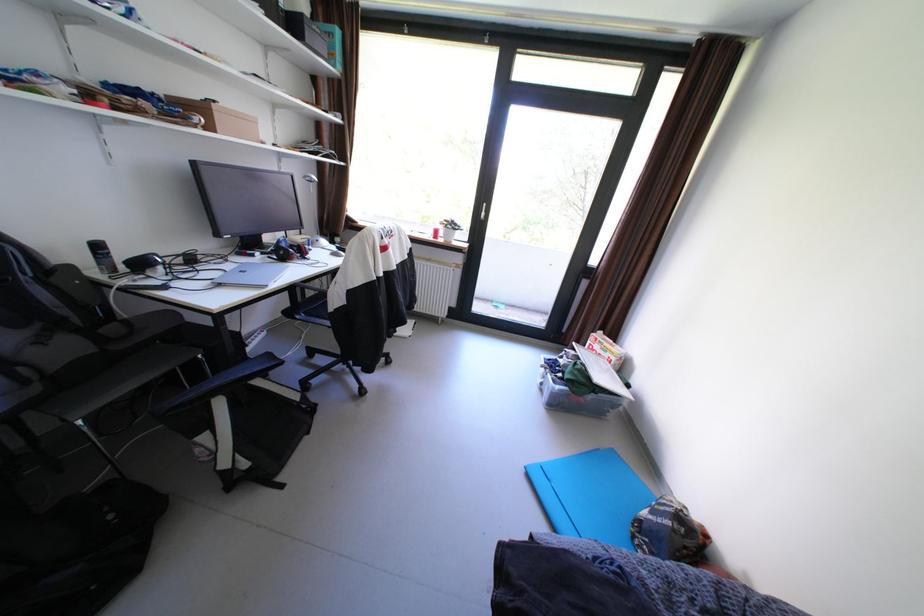
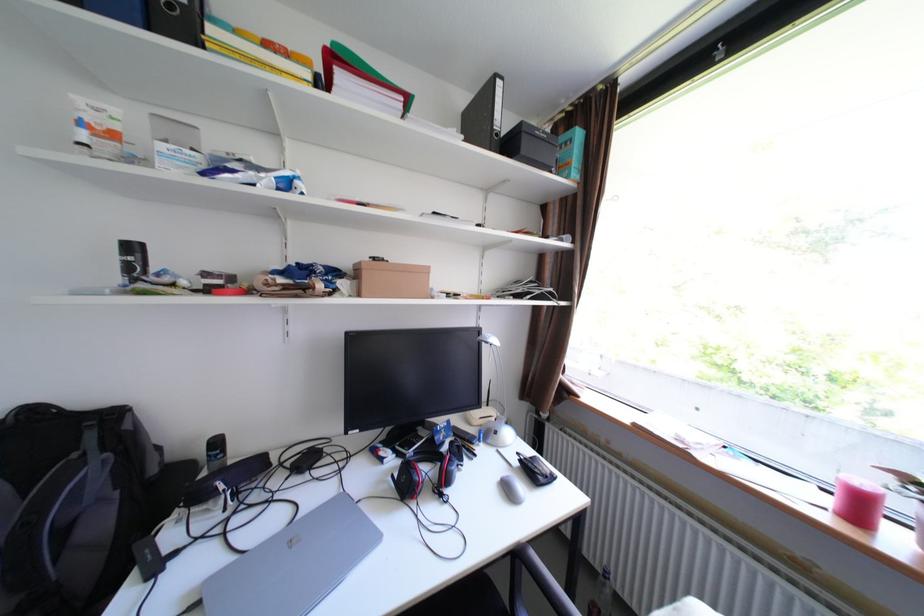
The point at (447, 228) is marked in the first image. Where is the corresponding point in the second image?

(874, 484)